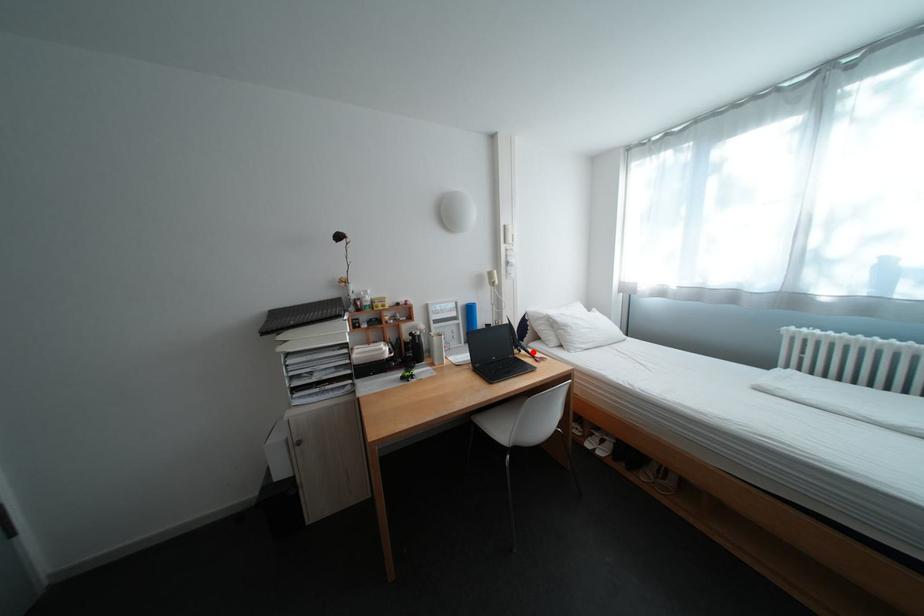
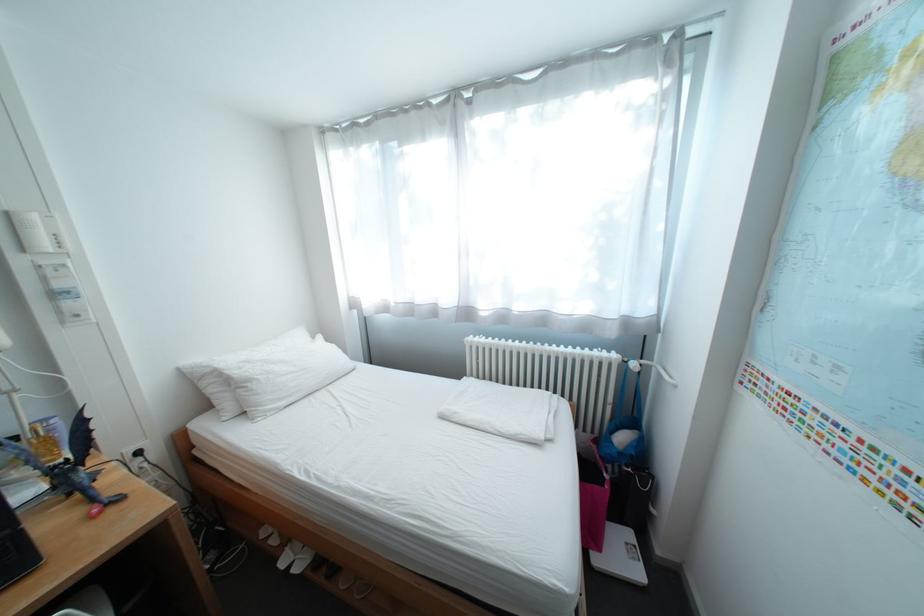
Where in the second image is the point corresponding to the highlighted location from the first image?

(81, 495)